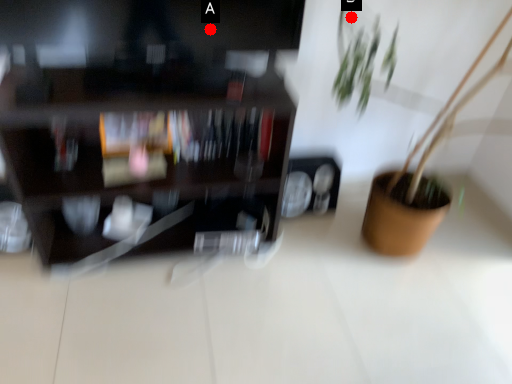
Question: Two points are circled on the image, labeled by A and B beside each circle. Which point is closer to the camera taking this photo?

Choices:
 (A) A is closer
 (B) B is closer

Answer: (A)